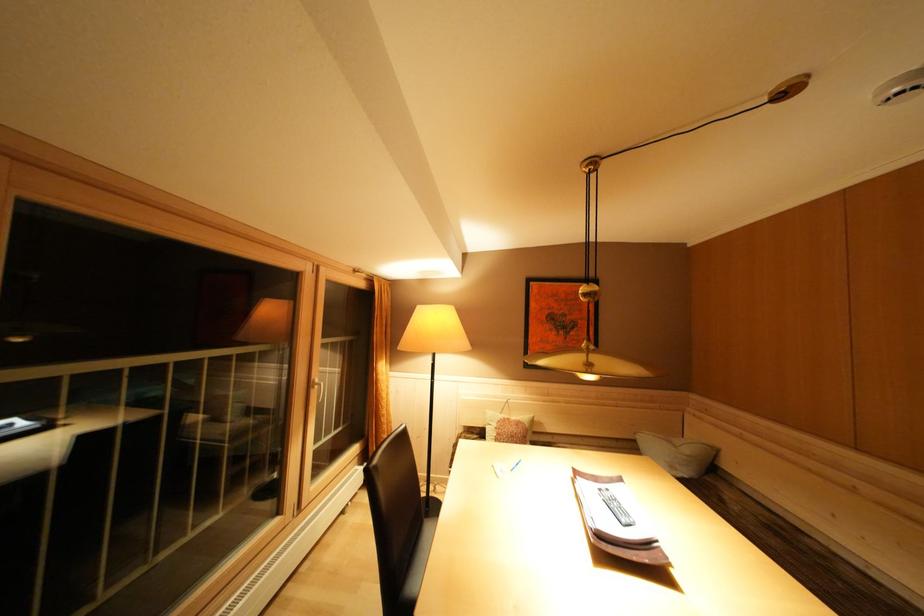
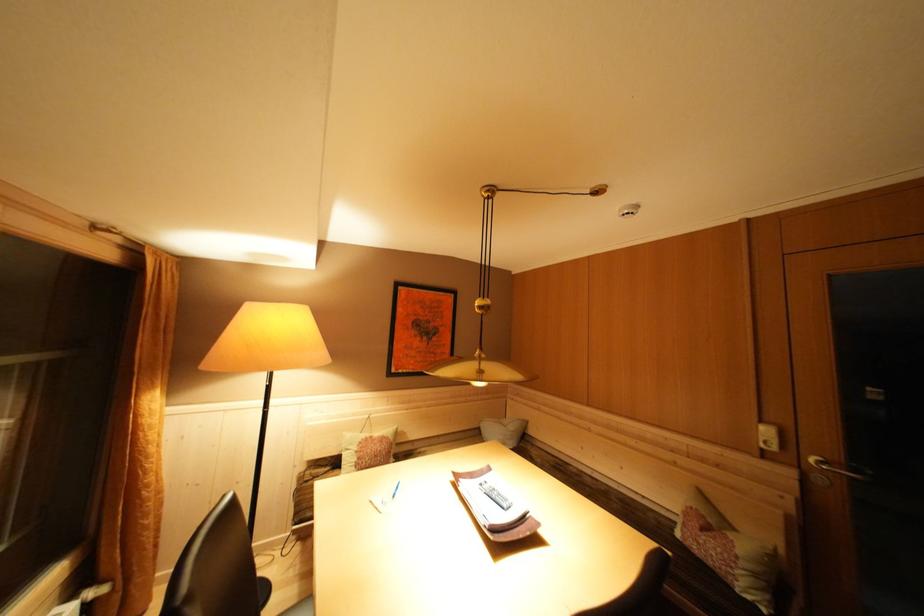
Question: How did the camera likely rotate?

Choices:
 (A) Left
 (B) Right
 (C) Up
 (D) Down

Answer: (B)